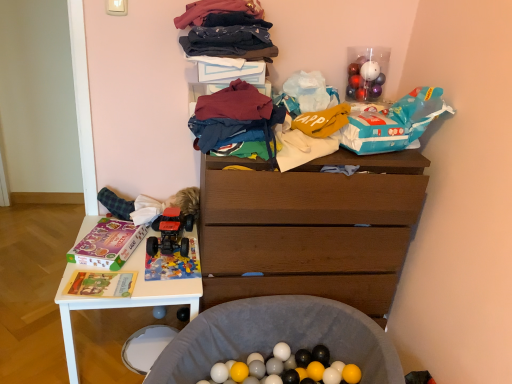
The height and width of the screenshot is (384, 512). Find the location of `free space above matte purple magazine at left, the 2th magazine in the front-to-back sequence (from a real-world perspective)`. free space above matte purple magazine at left, the 2th magazine in the front-to-back sequence (from a real-world perspective) is located at coordinates (109, 241).